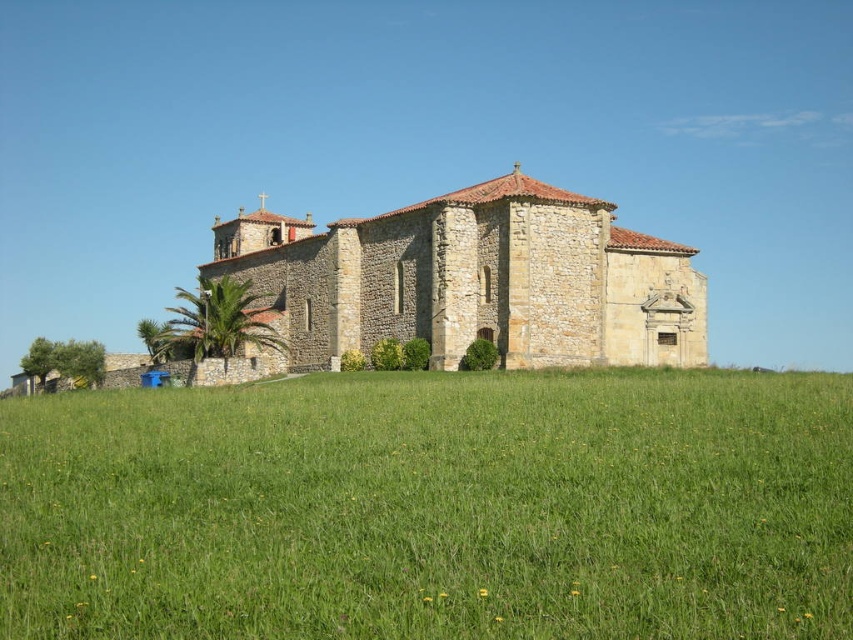
You are standing in the rural landscape and want to walk from the stone church at center to the green grass at lower center. Which direction should you move relative to the church?

You should move to the right of the stone church at center to reach the green grass at lower center since the green grass at lower center is located to the right of the stone church at center according to the description.

You are standing at the point marked as point (432, 508) in the image. What is the terrain like under your feet?

The terrain under your feet at point (432, 508) is green grass at lower center, which is soft and lush.

From the picture: You are standing in the rural landscape and want to take a photo of the stone church at center. To ensure the church is the main focus, where should you position yourself relative to the green grass at lower center?

You should position yourself closer to the green grass at lower center because it has a lesser height compared to the stone church at center, allowing the church to stand out more prominently in the photo.